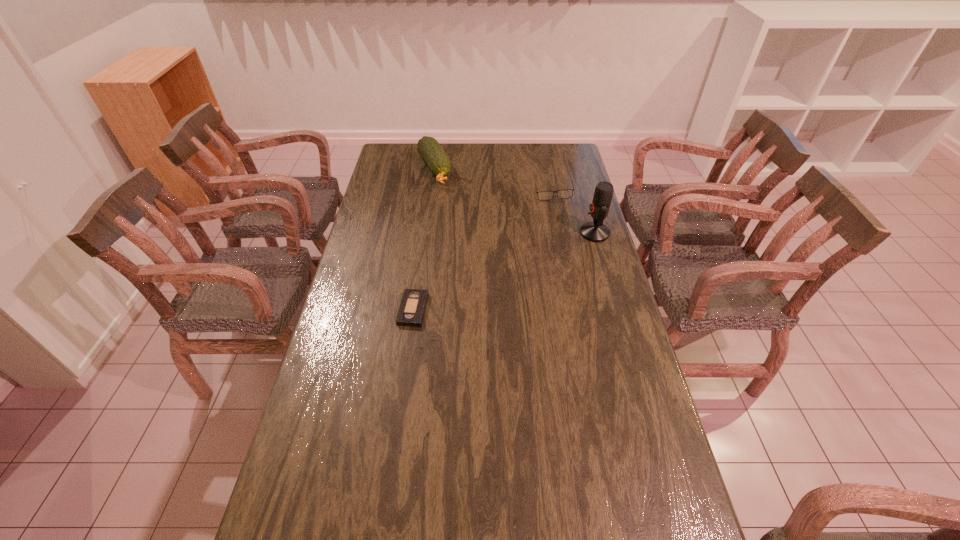
Image resolution: width=960 pixels, height=540 pixels. In order to click on unoccupied position between the microphone and the shortest object in this screenshot , I will do `click(504, 271)`.

You are a GUI agent. You are given a task and a screenshot of the screen. Output one action in this format:
    pyautogui.click(x=<x>, y=<y>)
    Task: Click on the free point between the second nearest object and the second shortest object
    This screenshot has height=540, width=960.
    Given the screenshot: What is the action you would take?
    pyautogui.click(x=574, y=213)

You are a GUI agent. You are given a task and a screenshot of the screen. Output one action in this format:
    pyautogui.click(x=<x>, y=<y>)
    Task: Click on the vacant region between the microphone and the shortest object
    The height and width of the screenshot is (540, 960).
    Given the screenshot: What is the action you would take?
    pyautogui.click(x=504, y=271)

In order to click on empty space between the shortest object and the third farthest object in this screenshot , I will do `click(504, 271)`.

Identify the location of free space between the spectacles and the second tallest object. (493, 182).

Where is `object that is the third closest one to the cucumber`? This screenshot has height=540, width=960. object that is the third closest one to the cucumber is located at coordinates (411, 312).

You are a GUI agent. You are given a task and a screenshot of the screen. Output one action in this format:
    pyautogui.click(x=<x>, y=<y>)
    Task: Click on the second closest object to the videotape
    This screenshot has width=960, height=540.
    Given the screenshot: What is the action you would take?
    pyautogui.click(x=596, y=231)

The width and height of the screenshot is (960, 540). Find the location of `free space that satisfies the following two spatial constraints: 1. on the back side of the nearest object; 2. on the side of the second nearest object with the red ring`. free space that satisfies the following two spatial constraints: 1. on the back side of the nearest object; 2. on the side of the second nearest object with the red ring is located at coordinates (424, 233).

Identify the location of free spot that satisfies the following two spatial constraints: 1. on the front side of the spectacles; 2. on the side of the third farthest object with the red ring. (562, 233).

At what (x,y) coordinates should I click in order to perform the action: click on blank space that satisfies the following two spatial constraints: 1. on the back side of the shortest object; 2. on the side of the tallest object with the red ring. Please return your answer as a coordinate pair (x, y). This screenshot has width=960, height=540. Looking at the image, I should click on (424, 233).